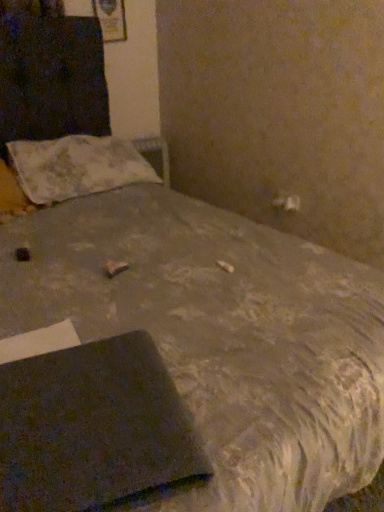
Question: Considering the relative sizes of fluffy white pillow at upper left and dark gray matte notebook at lower left in the image provided, is fluffy white pillow at upper left taller than dark gray matte notebook at lower left?

Choices:
 (A) yes
 (B) no

Answer: (A)

Question: Considering the relative positions of fluffy white pillow at upper left and dark gray matte notebook at lower left in the image provided, is fluffy white pillow at upper left to the right of dark gray matte notebook at lower left from the viewer's perspective?

Choices:
 (A) no
 (B) yes

Answer: (A)

Question: Is fluffy white pillow at upper left in front of dark gray matte notebook at lower left?

Choices:
 (A) yes
 (B) no

Answer: (B)

Question: Is fluffy white pillow at upper left smaller than dark gray matte notebook at lower left?

Choices:
 (A) no
 (B) yes

Answer: (A)

Question: Can you confirm if fluffy white pillow at upper left is thinner than dark gray matte notebook at lower left?

Choices:
 (A) yes
 (B) no

Answer: (B)

Question: From the image's perspective, is fluffy white pillow at upper left located beneath dark gray matte notebook at lower left?

Choices:
 (A) no
 (B) yes

Answer: (A)

Question: Is dark gray matte notebook at lower left positioned with its back to fluffy white pillow at upper left?

Choices:
 (A) yes
 (B) no

Answer: (A)

Question: Is dark gray matte notebook at lower left positioned far away from fluffy white pillow at upper left?

Choices:
 (A) yes
 (B) no

Answer: (A)

Question: Is dark gray matte notebook at lower left located outside fluffy white pillow at upper left?

Choices:
 (A) yes
 (B) no

Answer: (A)

Question: Is dark gray matte notebook at lower left closer to the viewer compared to fluffy white pillow at upper left?

Choices:
 (A) yes
 (B) no

Answer: (A)

Question: From a real-world perspective, is dark gray matte notebook at lower left beneath fluffy white pillow at upper left?

Choices:
 (A) no
 (B) yes

Answer: (B)

Question: From the image's perspective, is dark gray matte notebook at lower left over fluffy white pillow at upper left?

Choices:
 (A) yes
 (B) no

Answer: (B)

Question: Is fluffy white pillow at upper left to the left or to the right of dark gray matte notebook at lower left in the image?

Choices:
 (A) left
 (B) right

Answer: (A)